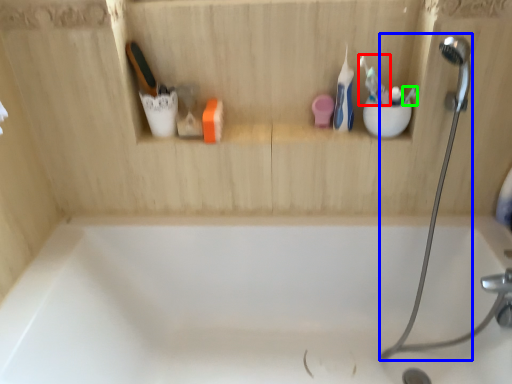
Question: Which is nearer to the toothbrush (highlighted by a red box)? shower (highlighted by a blue box) or toothbrush (highlighted by a green box).

Choices:
 (A) shower
 (B) toothbrush

Answer: (B)